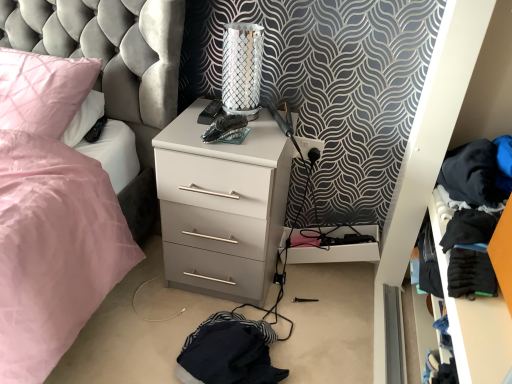
Where is `pink satin pillow at upper left`? The height and width of the screenshot is (384, 512). pink satin pillow at upper left is located at coordinates (42, 90).

Is pink satin pillow at upper left taller or shorter than silver metallic table lamp at upper center?

In the image, pink satin pillow at upper left appears to be shorter than silver metallic table lamp at upper center.

From the image's perspective, is pink satin pillow at upper left positioned above or below silver metallic table lamp at upper center?

pink satin pillow at upper left is below silver metallic table lamp at upper center.

Which of these two, pink satin pillow at upper left or silver metallic table lamp at upper center, is wider?

With larger width is pink satin pillow at upper left.

Would you say pink satin pillow at upper left contains silver metallic table lamp at upper center?

No, silver metallic table lamp at upper center is not surrounded by pink satin pillow at upper left.

Which is correct: black fabric clothes at right is inside silver metallic table lamp at upper center, or outside of it?

black fabric clothes at right exists outside the volume of silver metallic table lamp at upper center.

Which of these two, black fabric clothes at right or silver metallic table lamp at upper center, is bigger?

black fabric clothes at right is bigger.

From the image's perspective, would you say black fabric clothes at right is positioned over silver metallic table lamp at upper center?

Actually, black fabric clothes at right appears below silver metallic table lamp at upper center in the image.

From a real-world perspective, relative to silver metallic table lamp at upper center, is black fabric clothes at right vertically above or below?

black fabric clothes at right is below silver metallic table lamp at upper center.

Is black fabric clothes at right far from white matte chest of drawers at center?

black fabric clothes at right is actually quite close to white matte chest of drawers at center.

Considering the positions of point (480, 325) and point (241, 151), is point (480, 325) closer or farther from the camera than point (241, 151)?

Point (480, 325) is closer to the camera than point (241, 151).

Can you tell me how much black fabric clothes at right and white matte chest of drawers at center differ in facing direction?

They differ by 90.4 degrees in their facing directions.

From a real-world perspective, is black fabric clothes at right positioned over white matte chest of drawers at center based on gravity?

No, from a real-world perspective, black fabric clothes at right is not above white matte chest of drawers at center.

Which of these two, white matte chest of drawers at center or silver metallic table lamp at upper center, stands shorter?

silver metallic table lamp at upper center is shorter.

I want to click on chest of drawers that is on the left side of silver metallic table lamp at upper center, so click(222, 206).

From a real-world perspective, is white matte chest of drawers at center above or below silver metallic table lamp at upper center?

Clearly, from a real-world perspective, white matte chest of drawers at center is below silver metallic table lamp at upper center.

Is white matte chest of drawers at center aimed at silver metallic table lamp at upper center?

No, white matte chest of drawers at center is not oriented towards silver metallic table lamp at upper center.

Do you think silver metallic table lamp at upper center is within black fabric clothes at right, or outside of it?

silver metallic table lamp at upper center cannot be found inside black fabric clothes at right.

Considering the positions of objects silver metallic table lamp at upper center and black fabric clothes at right in the image provided, who is more to the left, silver metallic table lamp at upper center or black fabric clothes at right?

silver metallic table lamp at upper center.

Which of these two, silver metallic table lamp at upper center or black fabric clothes at right, is wider?

With larger width is silver metallic table lamp at upper center.

Does point (226, 32) come behind point (49, 83)?

No, (226, 32) is in front of (49, 83).

From a real-world perspective, which object stands above the other?

silver metallic table lamp at upper center is physically above.

In the image, is silver metallic table lamp at upper center positioned in front of or behind pink satin pillow at upper left?

In the image, silver metallic table lamp at upper center appears behind pink satin pillow at upper left.

Measure the distance from silver metallic table lamp at upper center to pink satin pillow at upper left.

They are 22.10 inches apart.

Is black fabric clothes at right at the back of pink satin pillow at upper left?

No, pink satin pillow at upper left is not facing away from black fabric clothes at right.

Can you confirm if pink satin pillow at upper left is taller than black fabric clothes at right?

In fact, pink satin pillow at upper left may be shorter than black fabric clothes at right.

From the image's perspective, who appears lower, pink satin pillow at upper left or black fabric clothes at right?

black fabric clothes at right, from the image's perspective.

Based on their sizes in the image, would you say pink satin pillow at upper left is bigger or smaller than black fabric clothes at right?

Considering their sizes, pink satin pillow at upper left takes up more space than black fabric clothes at right.

This screenshot has height=384, width=512. I want to click on table lamp positioned vertically above the pink satin pillow at upper left (from a real-world perspective), so click(242, 68).

The image size is (512, 384). I want to click on table lamp located behind the black fabric clothes at right, so click(x=242, y=68).

Looking at the image, which one is located closer to white matte chest of drawers at center, pink satin pillow at upper left or black fabric clothes at right?

Based on the image, pink satin pillow at upper left appears to be nearer to white matte chest of drawers at center.

From the image, which object appears to be nearer to black fabric clothes at right, white matte chest of drawers at center or silver metallic table lamp at upper center?

white matte chest of drawers at center.

Estimate the real-world distances between objects in this image. Which object is further from black fabric clothes at right, pink satin pillow at upper left or white matte chest of drawers at center?

pink satin pillow at upper left lies further to black fabric clothes at right than the other object.

From the image, which object appears to be farther from pink satin pillow at upper left, black fabric clothes at right or silver metallic table lamp at upper center?

black fabric clothes at right.

Looking at the image, which one is located closer to white matte chest of drawers at center, silver metallic table lamp at upper center or black fabric clothes at right?

silver metallic table lamp at upper center lies closer to white matte chest of drawers at center than the other object.

From the image, which object appears to be farther from pink satin pillow at upper left, silver metallic table lamp at upper center or black fabric clothes at right?

black fabric clothes at right is positioned further to the anchor pink satin pillow at upper left.

Based on their spatial positions, is silver metallic table lamp at upper center or pink satin pillow at upper left further from white matte chest of drawers at center?

pink satin pillow at upper left is positioned further to the anchor white matte chest of drawers at center.

Estimate the real-world distances between objects in this image. Which object is further from black fabric clothes at right, silver metallic table lamp at upper center or white matte chest of drawers at center?

silver metallic table lamp at upper center.

The height and width of the screenshot is (384, 512). Identify the location of the chest of drawers situated between pink satin pillow at upper left and black fabric clothes at right from left to right. (222, 206).

The image size is (512, 384). In order to click on the chest of drawers that lies between silver metallic table lamp at upper center and black fabric clothes at right from top to bottom in this screenshot , I will do `click(222, 206)`.

The image size is (512, 384). Identify the location of table lamp located between pink satin pillow at upper left and black fabric clothes at right in the left-right direction. (242, 68).

Find the location of `the chest of drawers located between pink satin pillow at upper left and silver metallic table lamp at upper center in the left-right direction`. the chest of drawers located between pink satin pillow at upper left and silver metallic table lamp at upper center in the left-right direction is located at coordinates (222, 206).